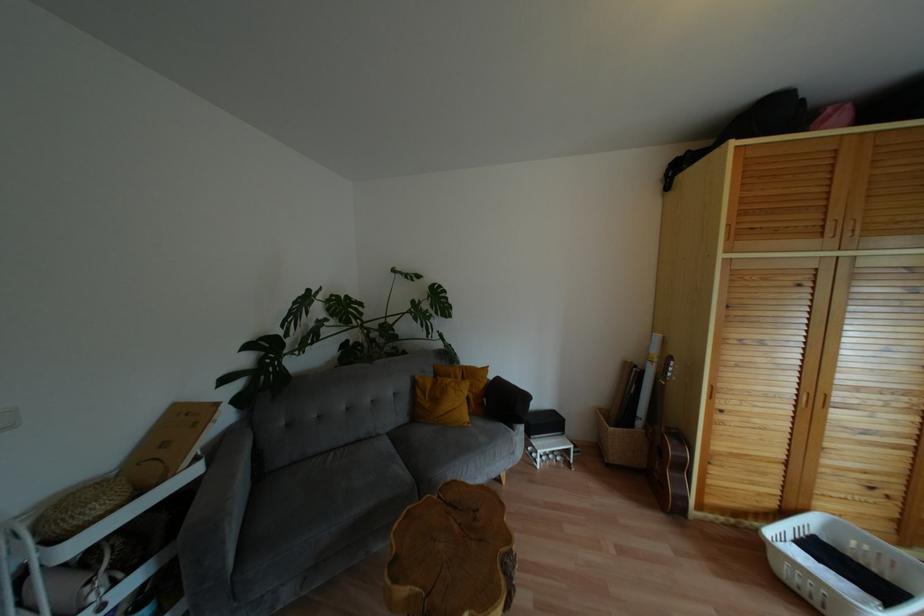
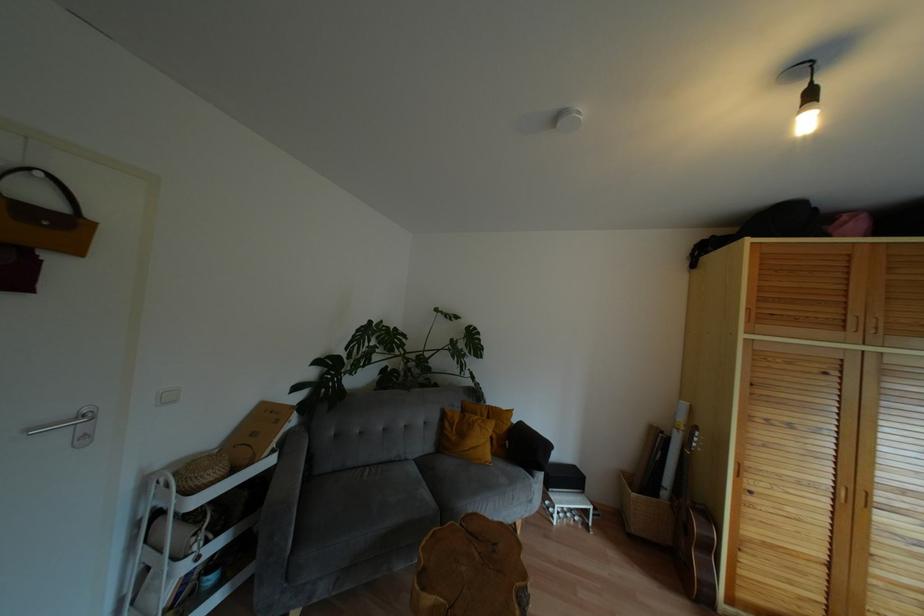
In the second image, find the point that corresponds to pixel 503 403 in the first image.

(524, 448)